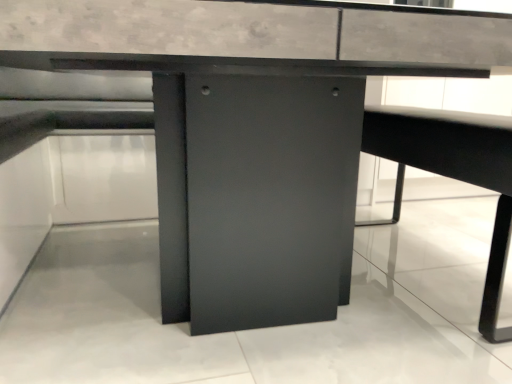
This screenshot has height=384, width=512. Describe the element at coordinates (455, 173) in the screenshot. I see `matte black table leg at center` at that location.

Measure the distance between matte black table leg at center and camera.

The depth of matte black table leg at center is 38.72 inches.

What is the approximate height of matte black table leg at center?

matte black table leg at center is 23.00 inches tall.

What are the coordinates of `matte black table leg at center` in the screenshot? It's located at (455, 173).

Locate an element on the screen. The width and height of the screenshot is (512, 384). matte black table leg at center is located at coordinates (455, 173).